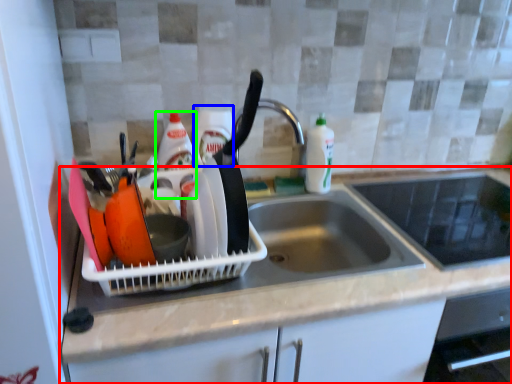
Question: Based on their relative distances, which object is farther from countertop (highlighted by a red box)? Choose from bottle (highlighted by a blue box) and bottle (highlighted by a green box).

Choices:
 (A) bottle
 (B) bottle

Answer: (B)